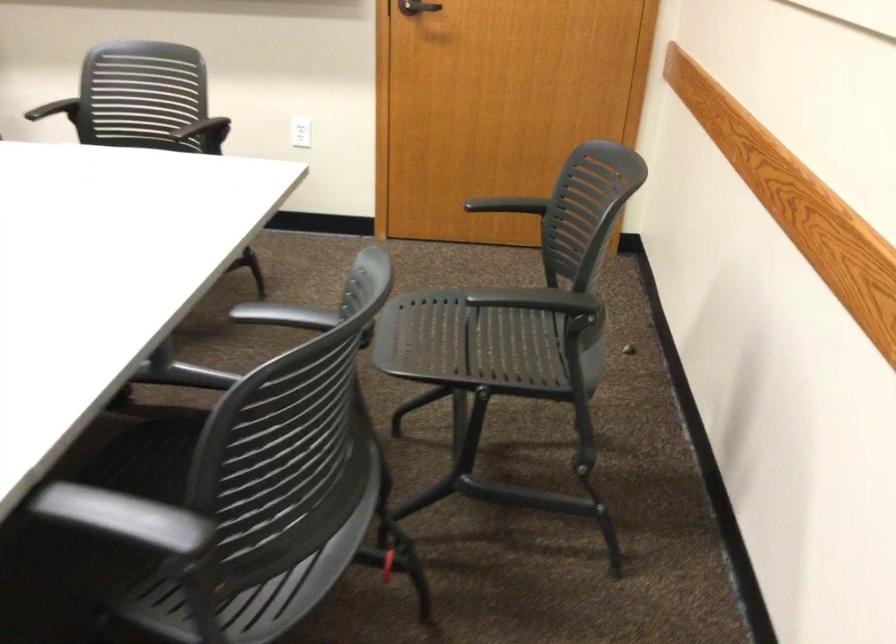
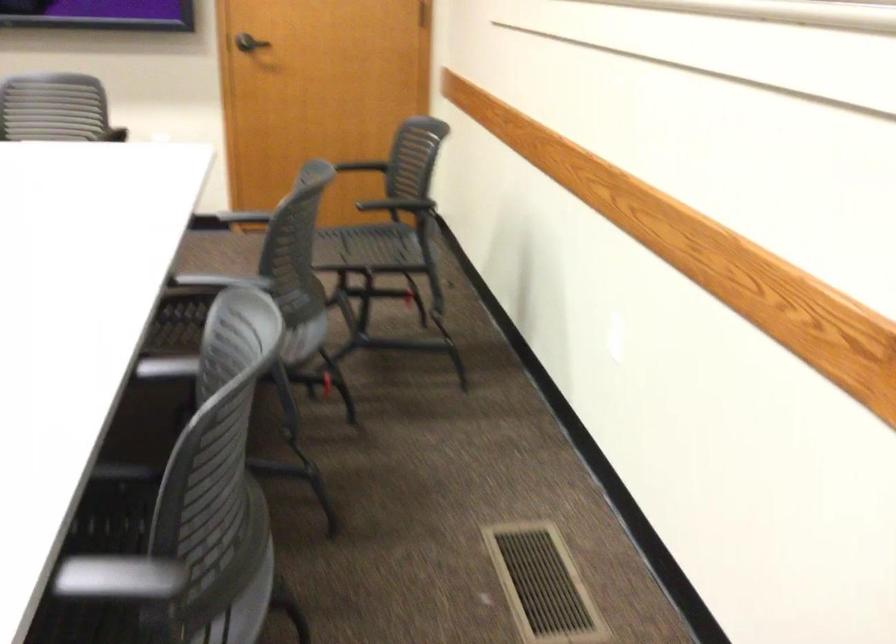
Locate, in the second image, the point that corresponds to the point at 533,295 in the first image.

(398, 205)